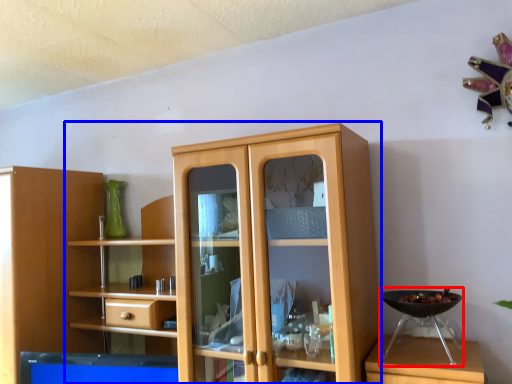
Question: Which object appears farthest to the camera in this image, appliance (highlighted by a red box) or cupboard (highlighted by a blue box)?

Choices:
 (A) appliance
 (B) cupboard

Answer: (A)